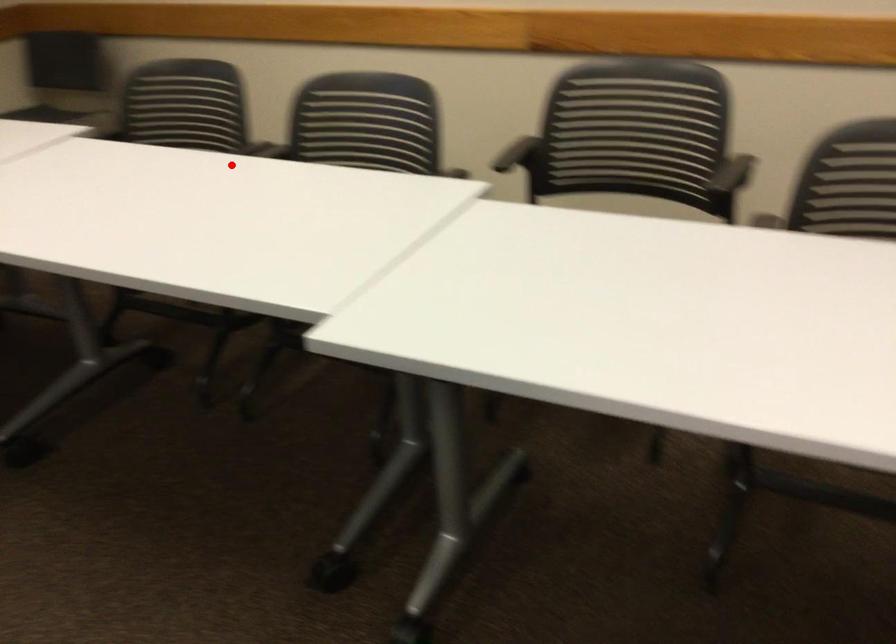
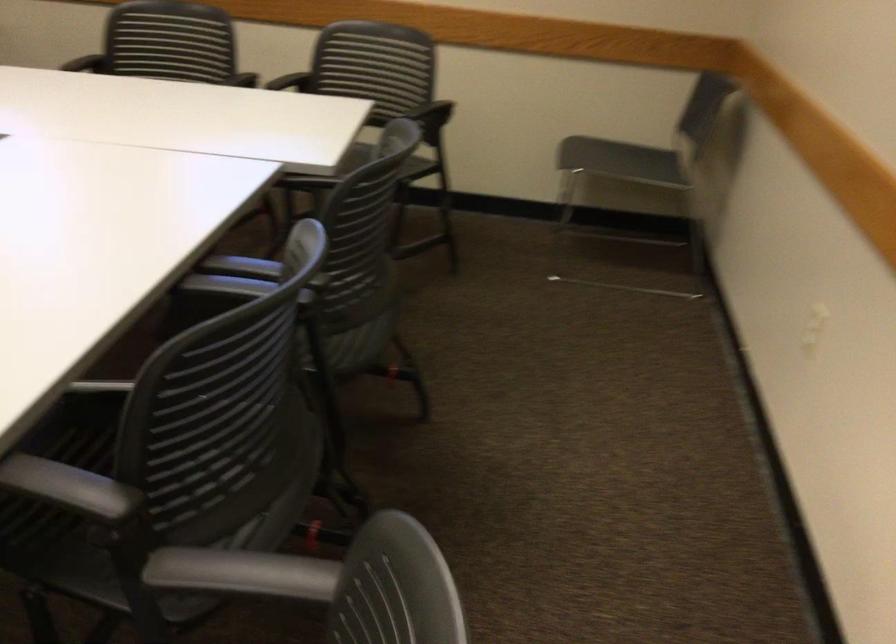
Question: I am providing you with two images of the same scene from different viewpoints. Image1 has a red point marked. In image2, the corresponding 3D location appears at what relative position? Reply with the corresponding letter.

Choices:
 (A) Closer
 (B) Farther

Answer: (A)